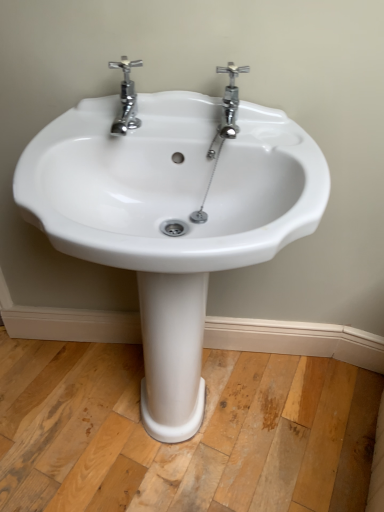
Identify the location of vacant area that lies between chrome/metallic faucet at upper left, the first tap from the left, and chrome/metallic faucet at upper center, the first tap in the right-to-left sequence. Image resolution: width=384 pixels, height=512 pixels. (177, 127).